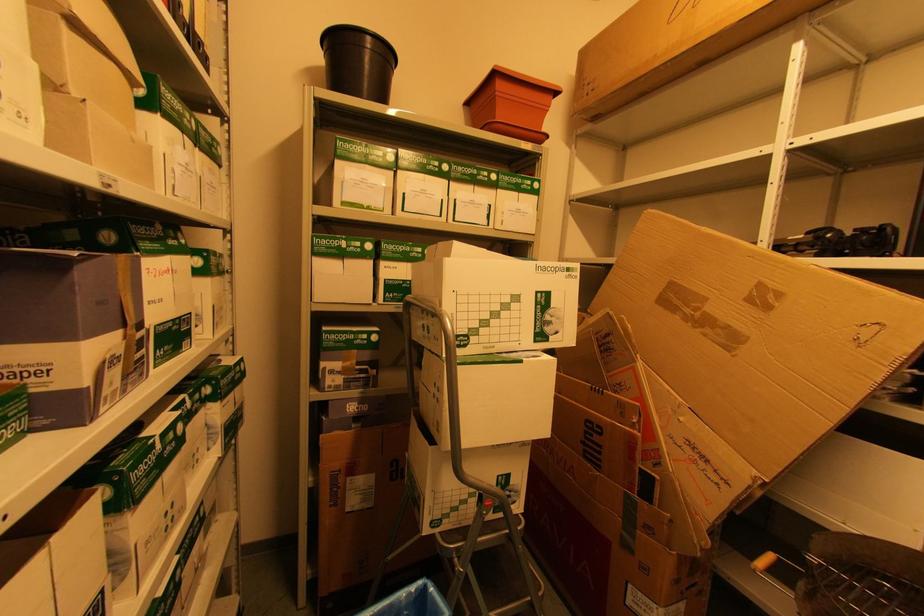
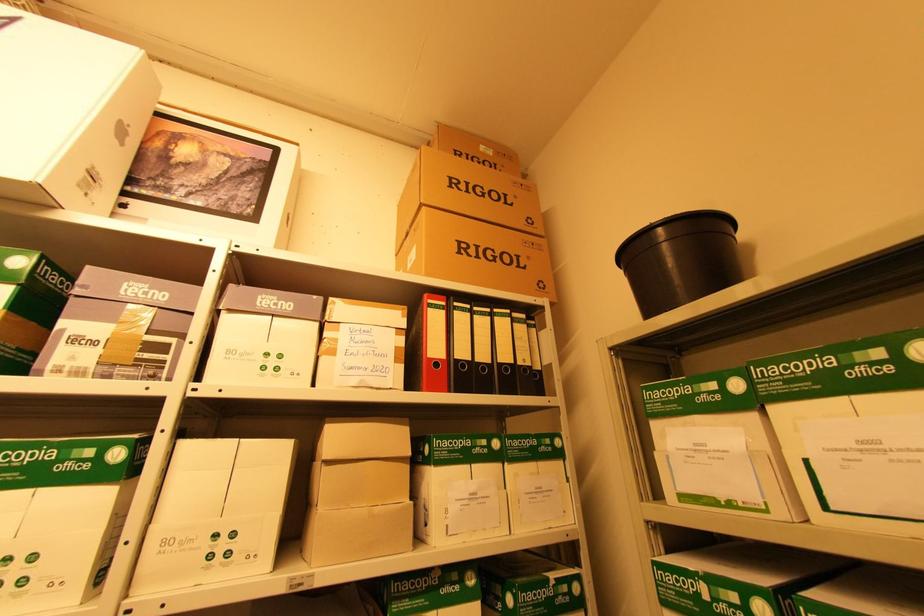
How did the camera likely rotate?

The camera rotated toward left-up.